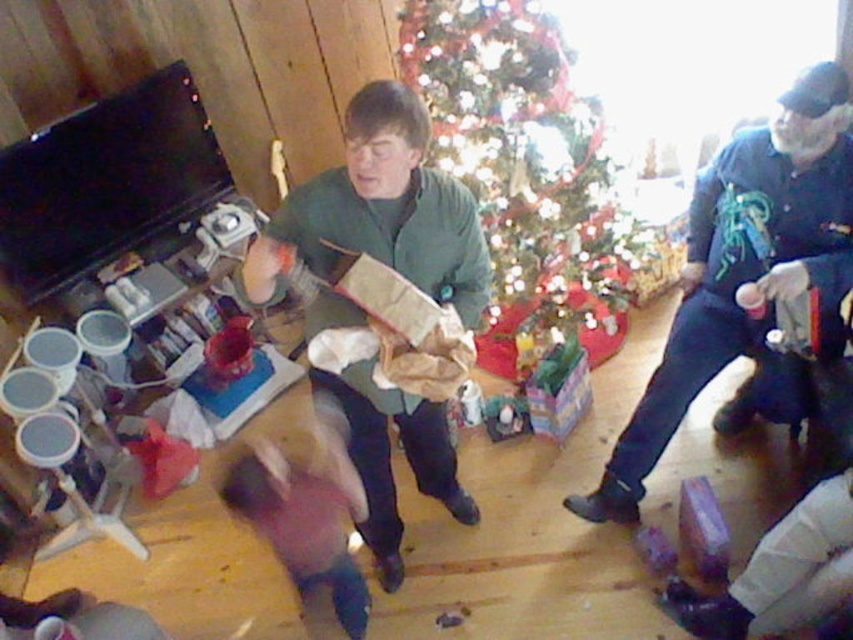
You are a guest at this holiday gathering and want to take a photo of the green matte jacket at center without the shiny green christmas tree at center appearing in the shot. How can you position yourself to achieve this?

Move forward so that the green matte jacket at center is no longer blocked by the shiny green christmas tree at center. Since the green matte jacket at center is behind the shiny green christmas tree at center, moving closer would allow you to frame the jacket without the tree obstructing it.

You are standing in the room and want to give a gift to the person wearing the blue denim jacket at right. Which direction should you move to reach them from the green matte jacket at center?

The blue denim jacket at right is to the right of the green matte jacket at center, so you should move to the right from the green matte jacket at center to reach the blue denim jacket at right.